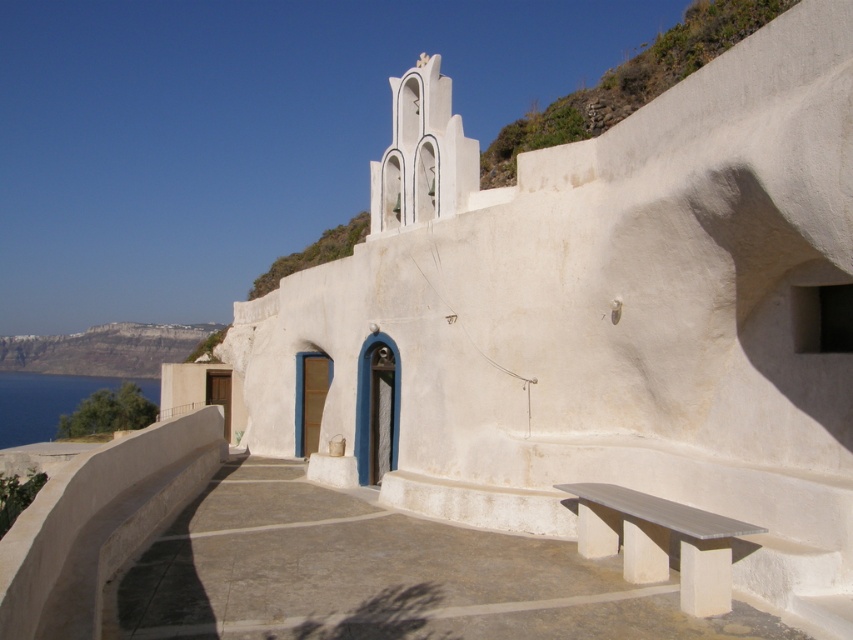
Is point (695, 1) positioned behind point (45, 413)?

No, it is in front of (45, 413).

Is greenish-brown rocky hillside at upper right below blue water at lower left?

Actually, greenish-brown rocky hillside at upper right is above blue water at lower left.

The height and width of the screenshot is (640, 853). In order to click on greenish-brown rocky hillside at upper right in this screenshot , I will do `click(628, 83)`.

Identify the location of greenish-brown rocky hillside at upper right. This screenshot has height=640, width=853. (628, 83).

Who is positioned more to the right, greenish-brown rocky hillside at upper right or white rocky cliff at left?

greenish-brown rocky hillside at upper right is more to the right.

Does greenish-brown rocky hillside at upper right appear on the left side of white rocky cliff at left?

No, greenish-brown rocky hillside at upper right is not to the left of white rocky cliff at left.

Who is more distant from viewer, (519, 150) or (39, 349)?

The point (39, 349) is more distant.

Where is `greenish-brown rocky hillside at upper right`? greenish-brown rocky hillside at upper right is located at coordinates (x=628, y=83).

Does greenish-brown rocky hillside at upper right appear on the left side of smooth white bench at lower right?

In fact, greenish-brown rocky hillside at upper right is to the right of smooth white bench at lower right.

In the scene shown: Between greenish-brown rocky hillside at upper right and smooth white bench at lower right, which one has less height?

Standing shorter between the two is smooth white bench at lower right.

The height and width of the screenshot is (640, 853). Identify the location of greenish-brown rocky hillside at upper right. (628, 83).